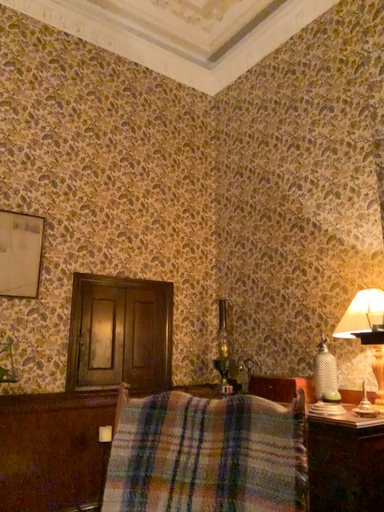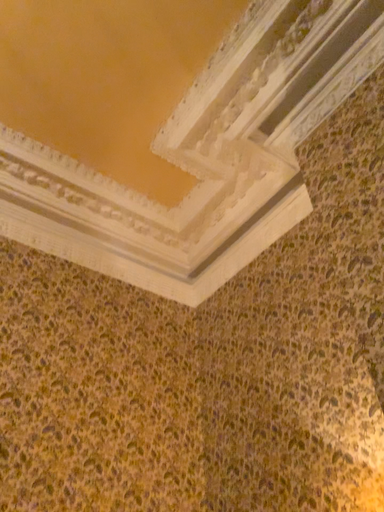
Question: Which way did the camera rotate in the video?

Choices:
 (A) rotated downward
 (B) rotated upward

Answer: (B)